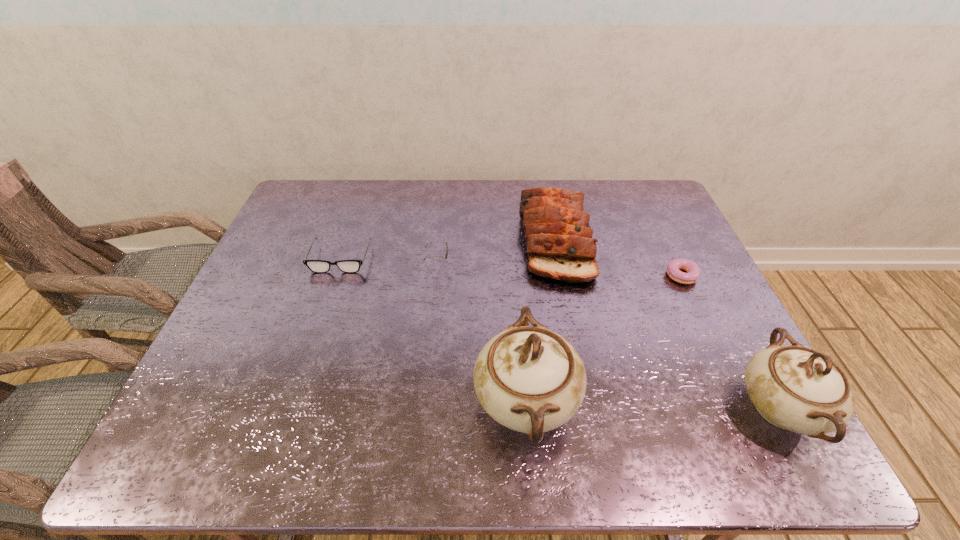
This screenshot has width=960, height=540. I want to click on vacant space that satisfies the following two spatial constraints: 1. on the back side of the taller chinaware; 2. on the left side of the shortest object, so click(516, 279).

I want to click on free point that satisfies the following two spatial constraints: 1. in front of the lenses of the fifth object from right to left; 2. on the back side of the doughnut, so click(436, 279).

Find the location of a particular element. The width and height of the screenshot is (960, 540). free space in the image that satisfies the following two spatial constraints: 1. on the front-facing side of the leftmost object; 2. on the left side of the shorter chinaware is located at coordinates (289, 409).

Where is `vacant area that satisfies the following two spatial constraints: 1. on the front-facing side of the tallest object; 2. on the left side of the second shortest object`? vacant area that satisfies the following two spatial constraints: 1. on the front-facing side of the tallest object; 2. on the left side of the second shortest object is located at coordinates (291, 402).